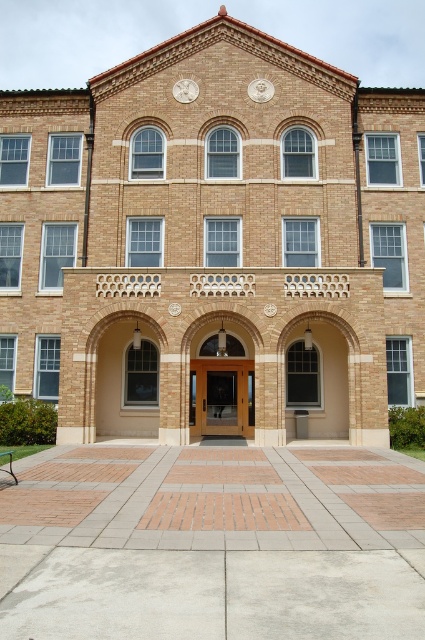
Question: Does wooden door at center appear on the left side of white marble clock at upper center?

Choices:
 (A) no
 (B) yes

Answer: (A)

Question: Can you confirm if wooden door at center is positioned to the left of white marble clock at upper center?

Choices:
 (A) no
 (B) yes

Answer: (A)

Question: Which of the following is the closest to the observer?

Choices:
 (A) (243, 420)
 (B) (181, 81)

Answer: (A)

Question: Is wooden door at center closer to camera compared to white marble clock at upper center?

Choices:
 (A) no
 (B) yes

Answer: (B)